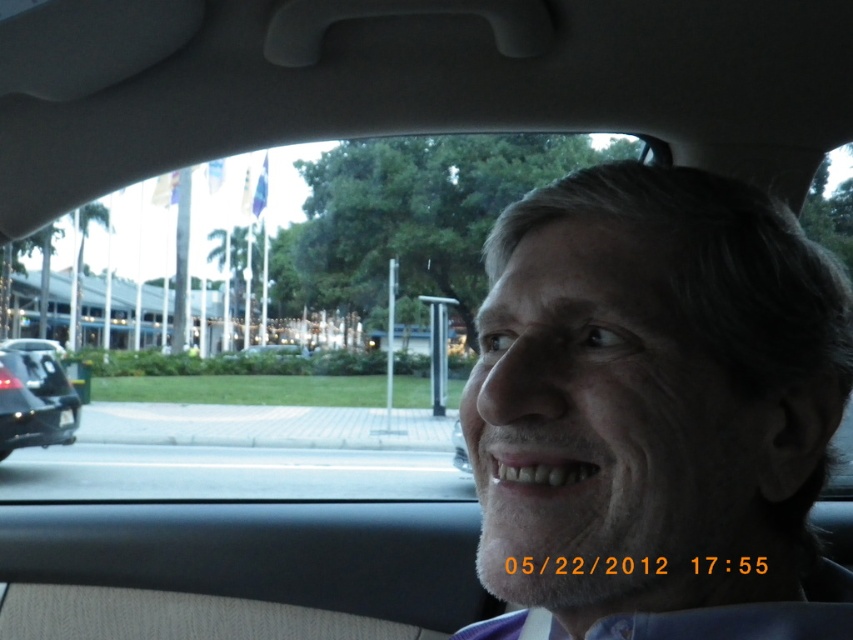
Question: Can you confirm if gray matte face at center is thinner than black glossy car at left?

Choices:
 (A) no
 (B) yes

Answer: (B)

Question: Which point is farther to the camera?

Choices:
 (A) gray matte face at center
 (B) black glossy car at left

Answer: (B)

Question: Can you confirm if gray matte face at center is positioned below black glossy car at left?

Choices:
 (A) no
 (B) yes

Answer: (A)

Question: Among these objects, which one is nearest to the camera?

Choices:
 (A) gray matte face at center
 (B) black glossy car at left

Answer: (A)

Question: Which of the following is the closest to the observer?

Choices:
 (A) gray matte face at center
 (B) black glossy car at left

Answer: (A)

Question: Is gray matte face at center smaller than black glossy car at left?

Choices:
 (A) yes
 (B) no

Answer: (A)